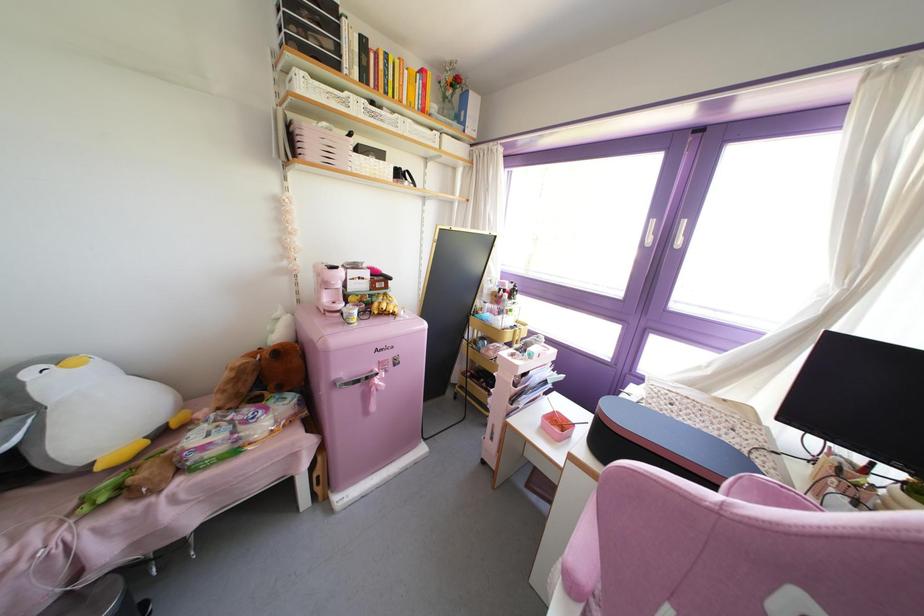
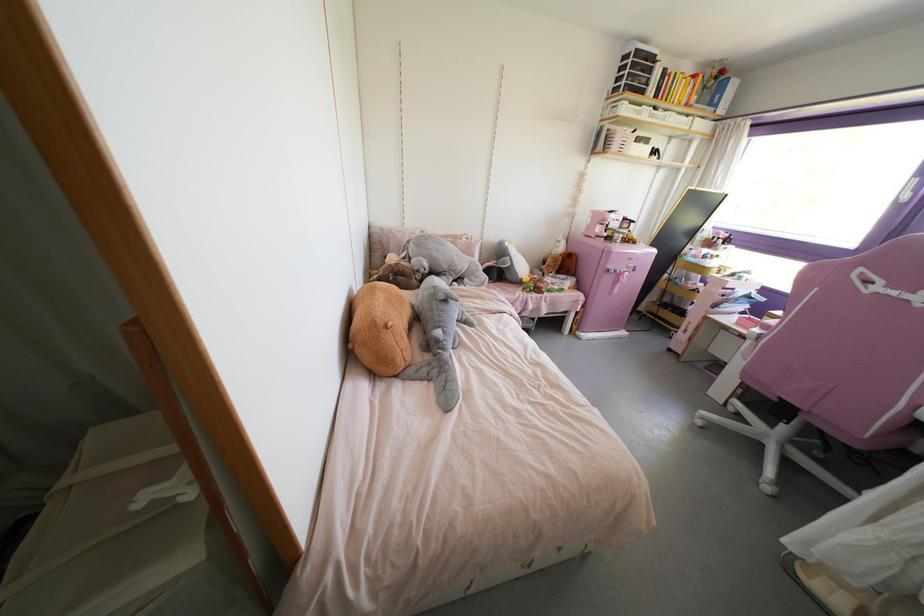
Where in the second image is the point corresponding to point 394,363 from the first image?

(633, 270)